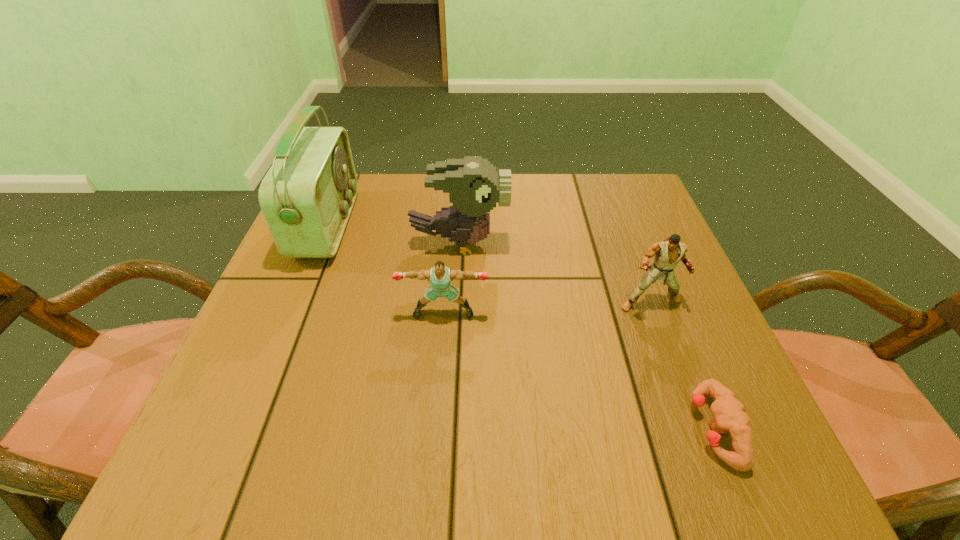
Where is `free space that is in between the bird and the leftmost object`? Image resolution: width=960 pixels, height=540 pixels. free space that is in between the bird and the leftmost object is located at coordinates (394, 234).

You are a GUI agent. You are given a task and a screenshot of the screen. Output one action in this format:
    pyautogui.click(x=<x>, y=<y>)
    Task: Click on the vacant area between the tallest puncher and the radio receiver
    The width and height of the screenshot is (960, 540).
    Given the screenshot: What is the action you would take?
    pyautogui.click(x=489, y=264)

At what (x,y) coordinates should I click in order to perform the action: click on free space between the radio receiver and the second shortest object. Please return your answer as a coordinate pair (x, y). Image resolution: width=960 pixels, height=540 pixels. Looking at the image, I should click on (385, 269).

The width and height of the screenshot is (960, 540). In order to click on empty space that is in between the nearest object and the fourth shortest object in this screenshot , I will do `click(587, 335)`.

Identify the location of object that can be found as the closest to the radio receiver. (474, 187).

Choose which object is the third nearest neighbor to the tallest puncher. Please provide its 2D coordinates. Your answer should be formatted as a tuple, i.e. [(x, y)], where the tuple contains the x and y coordinates of a point satisfying the conditions above.

[(440, 276)]

Locate an element on the screen. This screenshot has width=960, height=540. puncher that stands as the closest to the second shortest puncher is located at coordinates (669, 252).

Identify the location of puncher that is the nearest to the nearest puncher. The width and height of the screenshot is (960, 540). (669, 252).

The image size is (960, 540). What are the coordinates of `free spot that satisfies the following two spatial constraints: 1. at the beak of the bird; 2. on the front-facing side of the leftmost puncher` in the screenshot? It's located at (456, 313).

Where is `free space that satisfies the following two spatial constraints: 1. at the beak of the fourth shortest object; 2. on the front-facing side of the second shortest object`? The height and width of the screenshot is (540, 960). free space that satisfies the following two spatial constraints: 1. at the beak of the fourth shortest object; 2. on the front-facing side of the second shortest object is located at coordinates (456, 313).